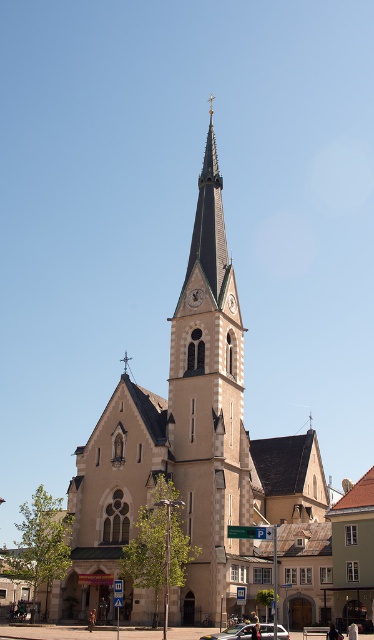
You are a photographer planning to capture a wide shot of the beige stone church at center and the silver metallic car at center from a distance. Which object will appear larger in the photo?

The beige stone church at center will appear larger in the photo because it is bigger than the silver metallic car at center.

You are a pedestrian standing in the town square and want to walk from the silver metallic car at center to the beige stone church at center. Which direction should you walk?

The beige stone church at center is positioned on the right side of the silver metallic car at center, so you should walk to your right to reach the beige stone church at center.

You are a photographer planning to capture both the beige stone church at center and the silver metallic car at center in a single frame. Based on their sizes, which object should you position closer to the camera to ensure both are visible clearly in the photo?

Since the beige stone church at center is wider than the silver metallic car at center, you should position the silver metallic car at center closer to the camera. This way, the car will appear larger in the frame, balancing its size with the church to ensure both are visible clearly.